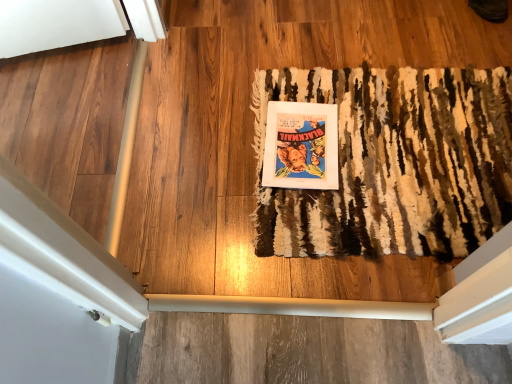
Where is `vacant area on top of matte paper poster at center (from a real-world perspective)`? vacant area on top of matte paper poster at center (from a real-world perspective) is located at coordinates (298, 137).